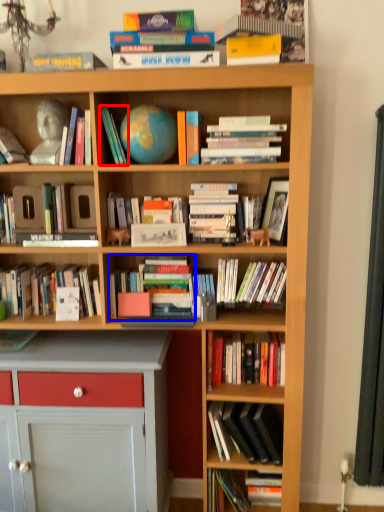
Question: Which object appears farthest to the camera in this image, book (highlighted by a red box) or book (highlighted by a blue box)?

Choices:
 (A) book
 (B) book

Answer: (B)